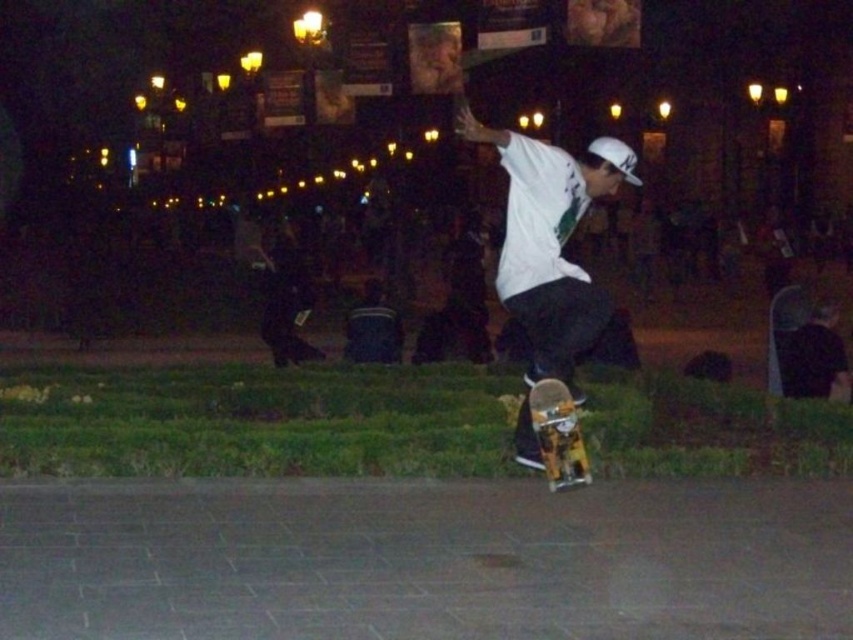
You are a photographer trying to capture the skateboarder in the image. The white matte shirt at center is represented by point (550, 241). Where should you position your camera to ensure the white matte shirt at center is in the frame?

The white matte shirt at center is represented by point (550, 241), so positioning the camera at a central angle facing the skateboarder would ensure the shirt is centered in the frame.

You are a photographer trying to capture the skateboarder in the scene. You need to ensure that both the white matte shirt at center and the yellow and black graphic skateboard at center are clearly visible in your shot. Given their sizes, which object should you focus on to ensure both are in frame without cropping?

Since the white matte shirt at center is wider than the yellow and black graphic skateboard at center, you should focus on the white matte shirt at center to ensure both objects fit within the frame without cropping.